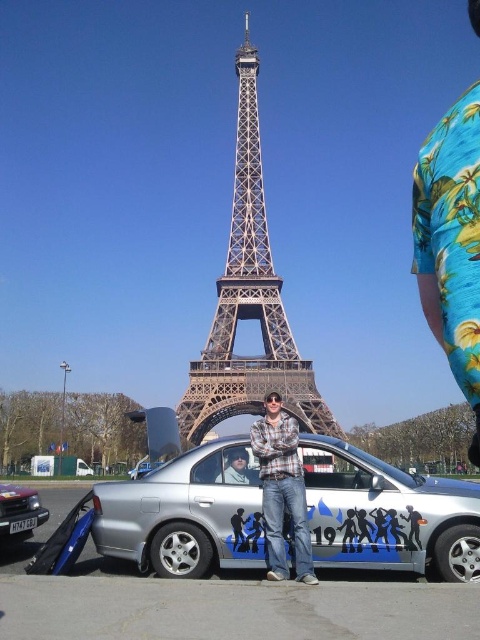
Question: Considering the relative positions of matte black jacket at center and silver metallic sedan at center in the image provided, where is matte black jacket at center located with respect to silver metallic sedan at center?

Choices:
 (A) below
 (B) above

Answer: (B)

Question: Among these points, which one is farthest from the camera?

Choices:
 (A) (34, 515)
 (B) (297, 554)
 (C) (210, 456)
 (D) (228, 248)

Answer: (D)

Question: Which point is closer to the camera?

Choices:
 (A) (241, 464)
 (B) (151, 545)
 (C) (262, 445)
 (D) (229, 401)

Answer: (D)

Question: Is silver metallic car at center behind shiny black car at lower left?

Choices:
 (A) yes
 (B) no

Answer: (B)

Question: Which point is farther to the camera?

Choices:
 (A) silver metallic car at center
 (B) metallic silver tower at center

Answer: (A)

Question: Can you confirm if metallic silver tower at center is positioned to the right of shiny black car at lower left?

Choices:
 (A) yes
 (B) no

Answer: (A)